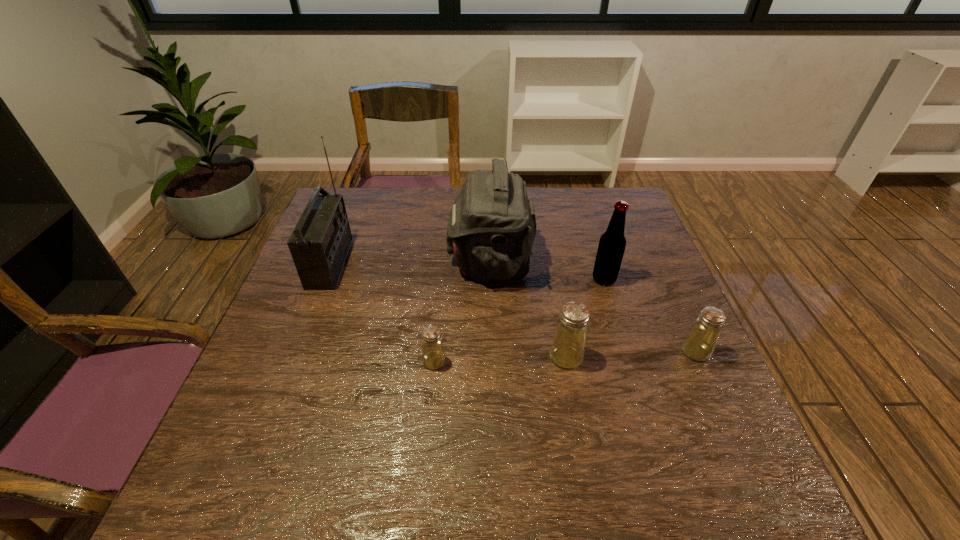
Image resolution: width=960 pixels, height=540 pixels. In order to click on the shortest saltshaker in this screenshot , I will do `click(433, 356)`.

The image size is (960, 540). In order to click on the shortest object in this screenshot , I will do `click(433, 356)`.

Image resolution: width=960 pixels, height=540 pixels. I want to click on the tallest saltshaker, so click(x=567, y=350).

You are a GUI agent. You are given a task and a screenshot of the screen. Output one action in this format:
    pyautogui.click(x=<x>, y=<y>)
    Task: Click on the second saltshaker from right to left
    
    Given the screenshot: What is the action you would take?
    pyautogui.click(x=567, y=350)

In order to click on the second shortest object in this screenshot , I will do `click(699, 344)`.

The image size is (960, 540). Identify the location of the second tallest saltshaker. (699, 344).

Identify the location of shoulder bag. (491, 228).

Identify the location of the leftmost object. (319, 244).

This screenshot has height=540, width=960. In order to click on beer bottle in this screenshot , I will do `click(612, 243)`.

Image resolution: width=960 pixels, height=540 pixels. What are the coordinates of `the third tallest object` in the screenshot? It's located at (x=612, y=243).